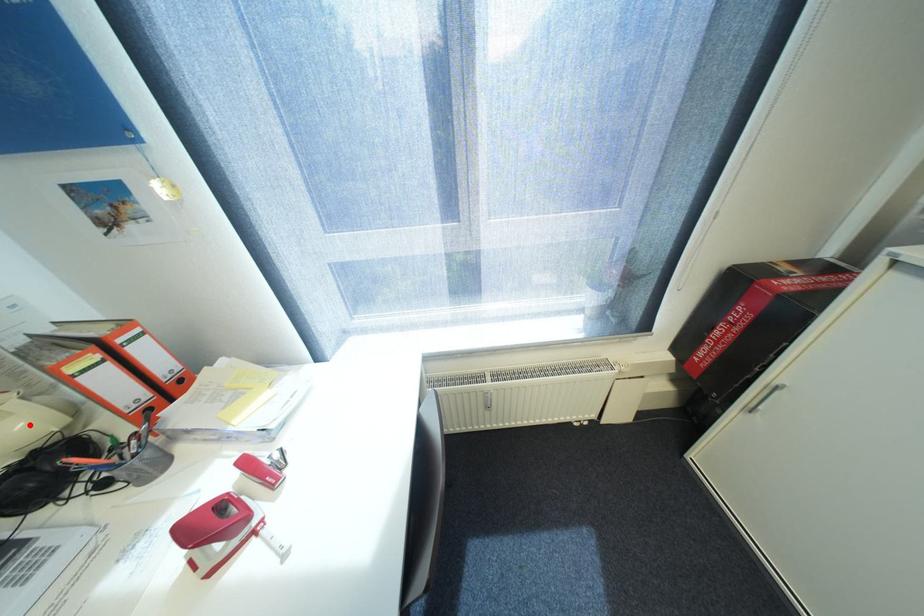
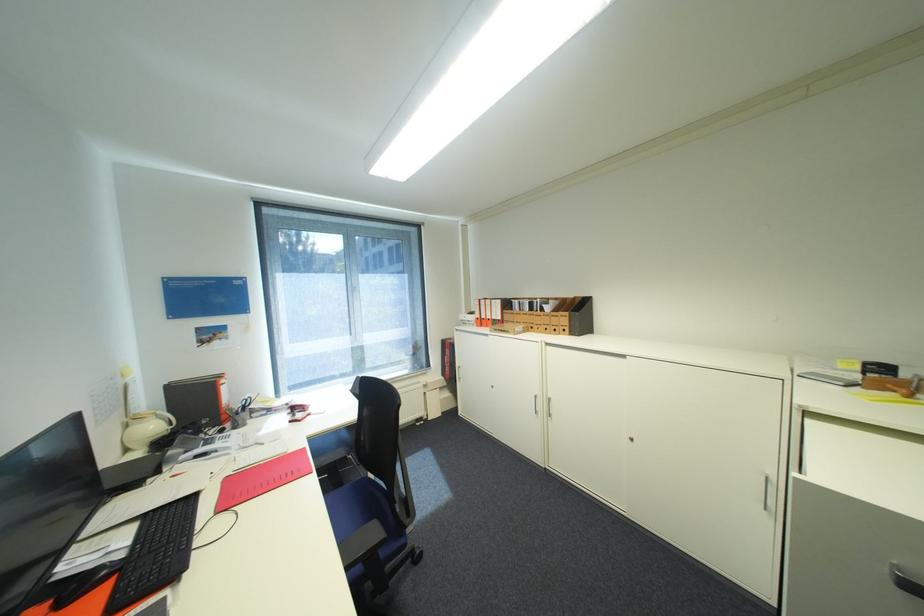
Question: I am providing you with two images of the same scene from different viewpoints. A red point is shown in image1. For the corresponding object point in image2, is it positioned nearer or farther from the camera?

Choices:
 (A) Nearer
 (B) Farther

Answer: (A)